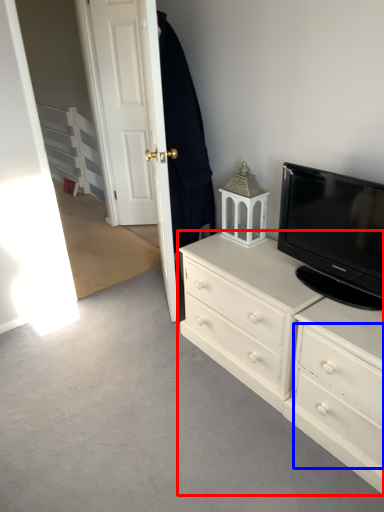
Question: Which point is further to the camera, chest of drawers (highlighted by a red box) or drawer (highlighted by a blue box)?

Choices:
 (A) chest of drawers
 (B) drawer

Answer: (A)